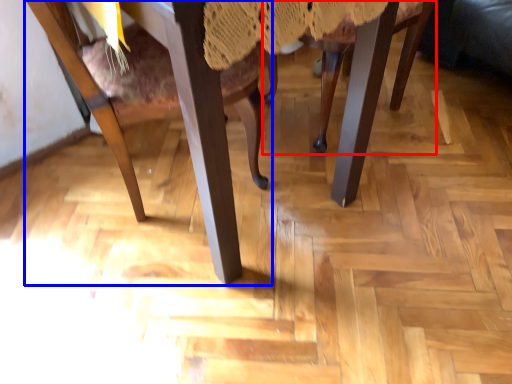
Question: Which object is closer to the camera taking this photo, chair (highlighted by a red box) or chair (highlighted by a blue box)?

Choices:
 (A) chair
 (B) chair

Answer: (B)